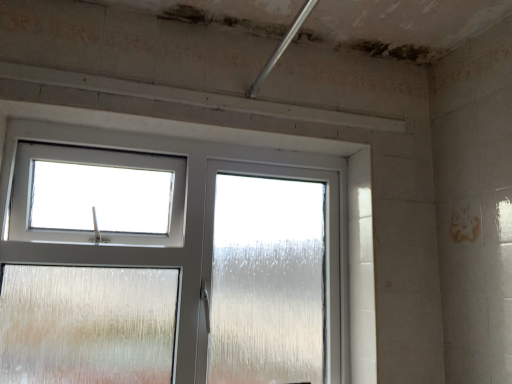
You are a GUI agent. You are given a task and a screenshot of the screen. Output one action in this format:
    pyautogui.click(x=<x>, y=<y>)
    Task: Click on the frosted glass window at center
    The image size is (512, 384).
    Given the screenshot: What is the action you would take?
    pyautogui.click(x=173, y=264)

Image resolution: width=512 pixels, height=384 pixels. What do you see at coordinates (173, 264) in the screenshot?
I see `frosted glass window at center` at bounding box center [173, 264].

Find the location of a particular element. frosted glass window at center is located at coordinates (173, 264).